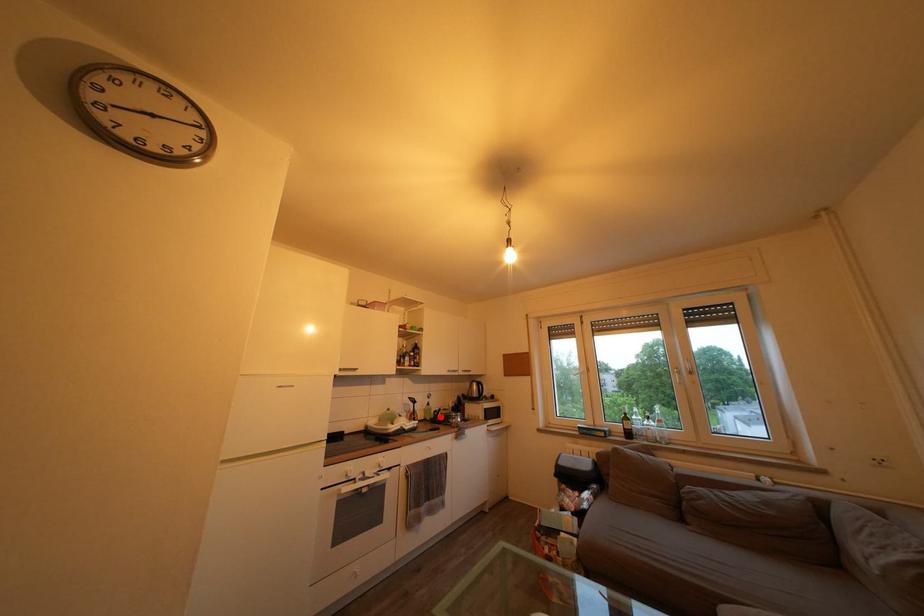
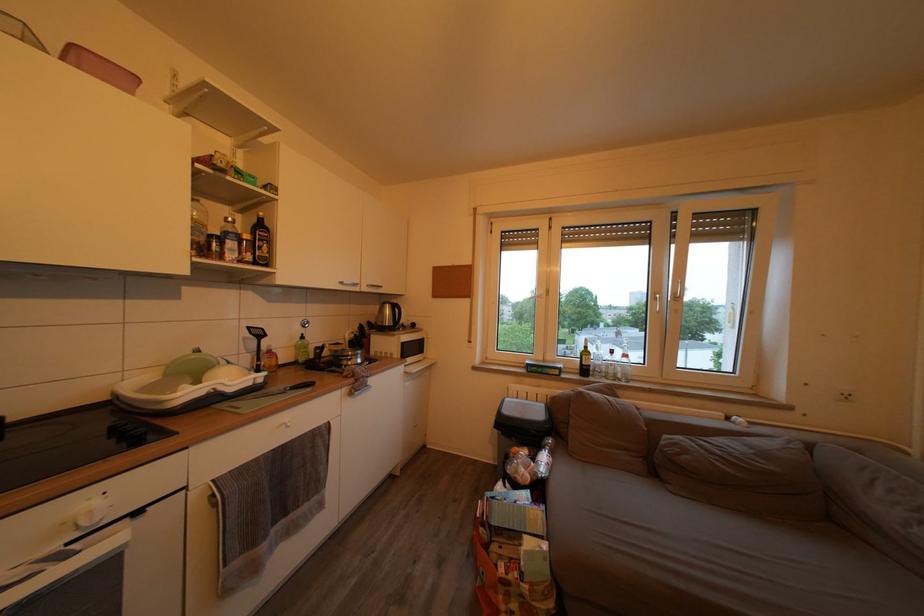
Question: I am providing you with two images of the same scene from different viewpoints. In image1, a red point is highlighted. Considering the same 3D point in image2, which of the following is correct?

Choices:
 (A) It is closer
 (B) It is farther

Answer: (A)